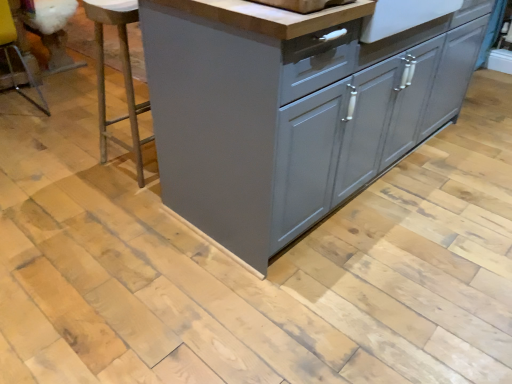
At what (x,y) coordinates should I click in order to perform the action: click on blank area to the left of metallic silver bar stool at left, which is counted as the first bar stool, starting from the right. Please return your answer as a coordinate pair (x, y). The image size is (512, 384). Looking at the image, I should click on (79, 163).